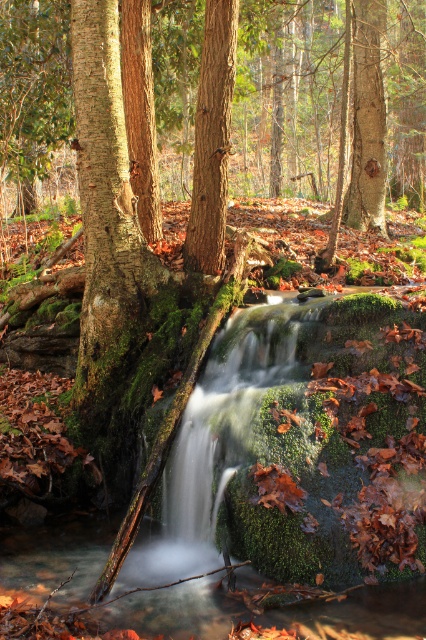
Is smooth brown tree trunk at center to the right of rough bark tree trunk at upper center from the viewer's perspective?

No, smooth brown tree trunk at center is not to the right of rough bark tree trunk at upper center.

Which is below, smooth brown tree trunk at center or rough bark tree trunk at upper center?

Positioned lower is smooth brown tree trunk at center.

The height and width of the screenshot is (640, 426). Find the location of `smooth brown tree trunk at center`. smooth brown tree trunk at center is located at coordinates (212, 140).